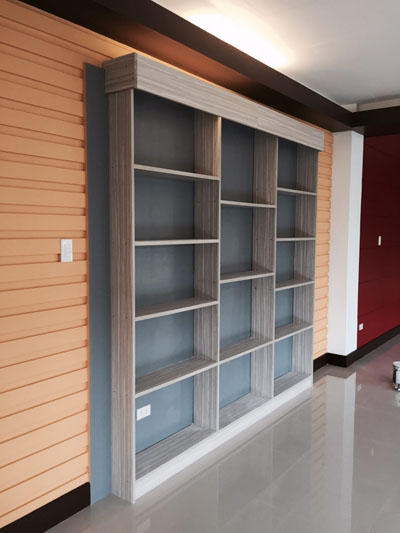
The image size is (400, 533). Find the location of `red color wall`. red color wall is located at coordinates (381, 190).